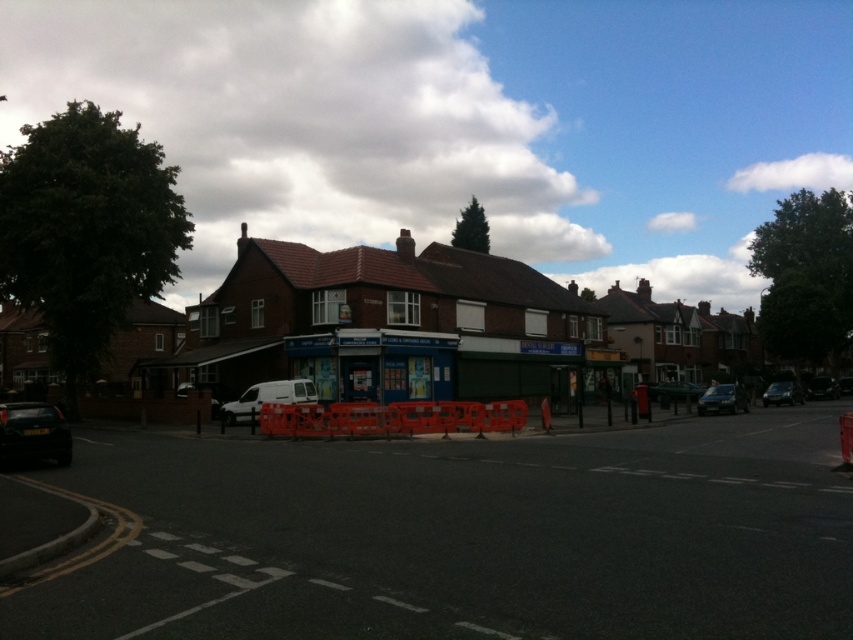
You are a delivery driver trying to park your vehicle in this residential area. You see the shiny black car at lower left and the shiny silver car at center. Which car is positioned closer to the left side of the road?

The shiny black car at lower left is positioned closer to the left side of the road since it is to the left of the shiny silver car at center.

You are a pedestrian standing at the edge of the road. You see a shiny black car at lower left and a shiny silver car at center. Which car is nearer to you?

The shiny black car at lower left is closer to the viewer than the shiny silver car at center.

You are a delivery driver who needs to park your shiny silver car at right on the black asphalt road at center. Considering the road width, will your car fit without overlapping the road edges?

The black asphalt road at center is wider than the shiny silver car at right, so the car will fit without overlapping the road edges.